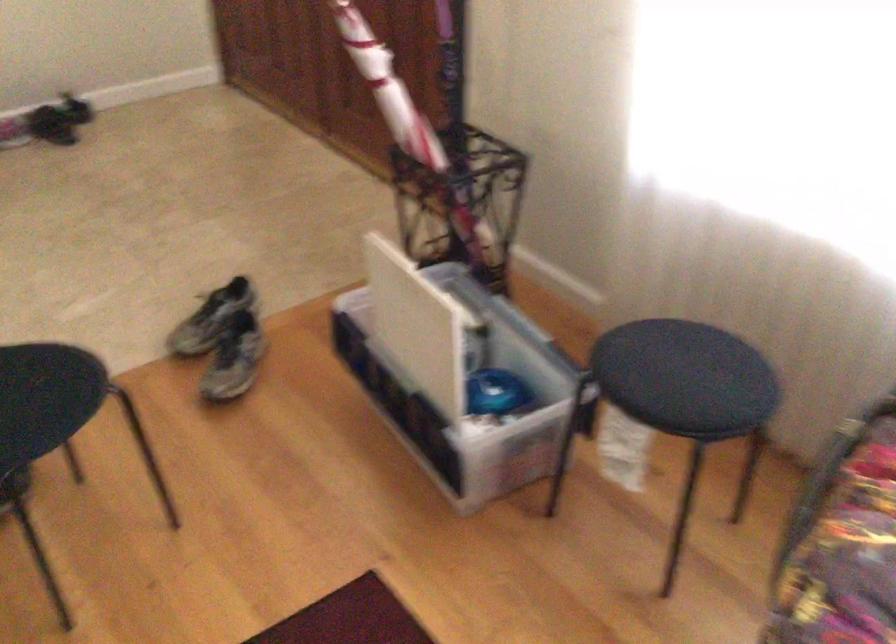
This screenshot has width=896, height=644. I want to click on sofa sitting surface, so click(x=848, y=561).